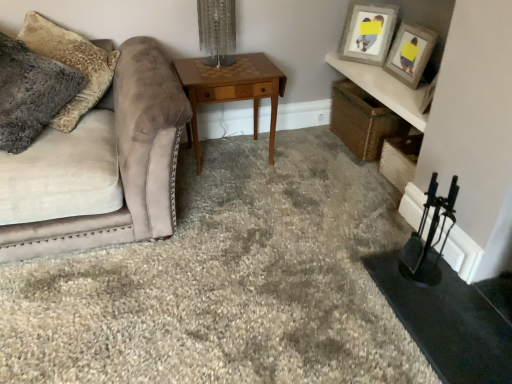
Where is `free space above woodenobject at center (from a real-world perspective)`? free space above woodenobject at center (from a real-world perspective) is located at coordinates (228, 68).